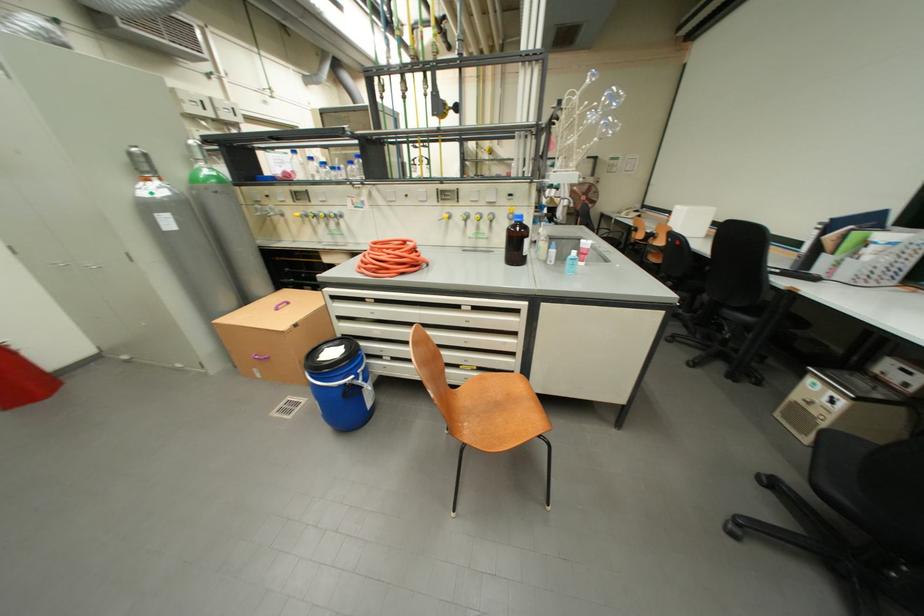
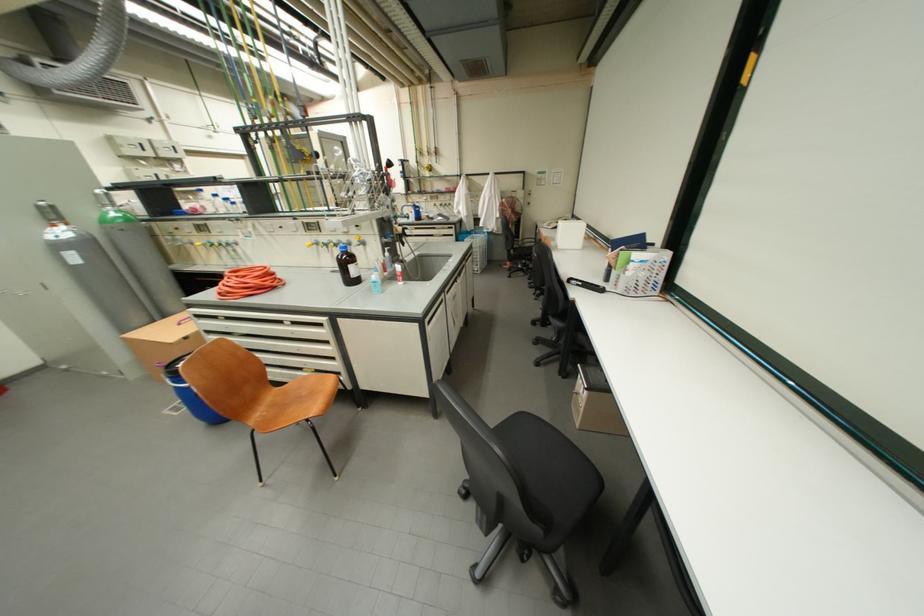
Question: The images are taken continuously from a first-person perspective. In which direction are you moving?

Choices:
 (A) Left
 (B) Right
 (C) Forward
 (D) Backward

Answer: (B)